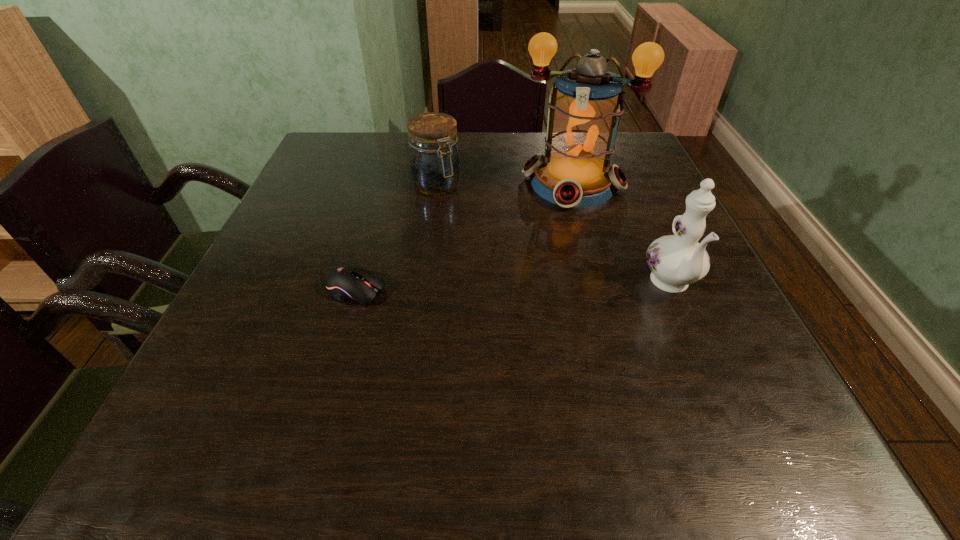
The width and height of the screenshot is (960, 540). Find the location of `vacant space at the left edge of the desktop`. vacant space at the left edge of the desktop is located at coordinates pos(292,315).

Where is `vacant space at the right edge of the desktop`? The height and width of the screenshot is (540, 960). vacant space at the right edge of the desktop is located at coordinates (631, 235).

This screenshot has height=540, width=960. I want to click on vacant space at the near left corner, so click(219, 372).

The width and height of the screenshot is (960, 540). What are the coordinates of `vacant area at the far right corner of the desktop` in the screenshot? It's located at (647, 164).

Identify the location of vacant area at the near right corner. The width and height of the screenshot is (960, 540). (731, 374).

What are the coordinates of `vacant area that lies between the chinaware and the computer mouse` in the screenshot? It's located at (514, 288).

Locate an element on the screen. This screenshot has width=960, height=540. vacant region between the shortest object and the jar is located at coordinates (396, 238).

I want to click on free space between the lantern and the shortest object, so click(465, 237).

This screenshot has width=960, height=540. What are the coordinates of `free space that is in between the lantern and the third shortest object` in the screenshot? It's located at (622, 234).

This screenshot has height=540, width=960. In order to click on free space between the leftmost object and the third shortest object in this screenshot , I will do `click(514, 288)`.